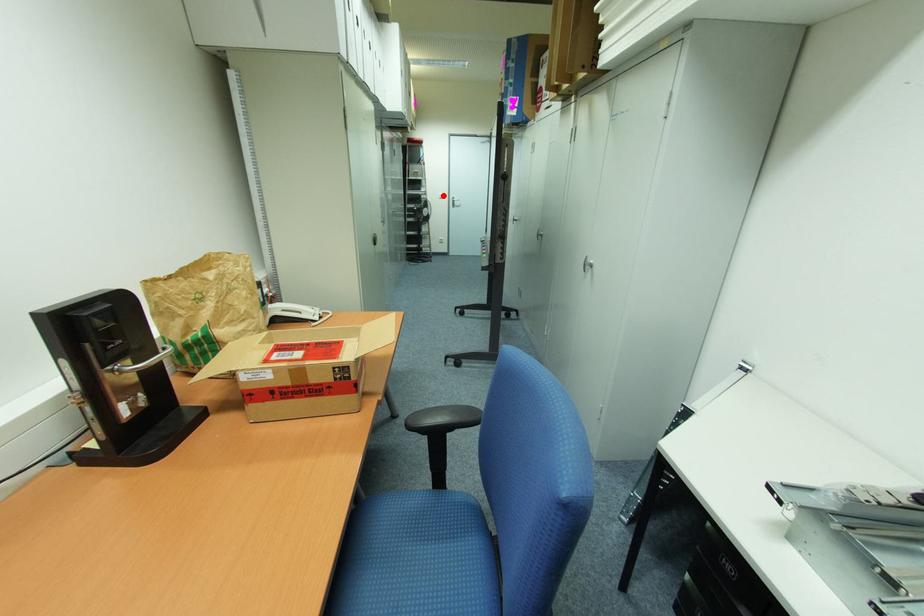
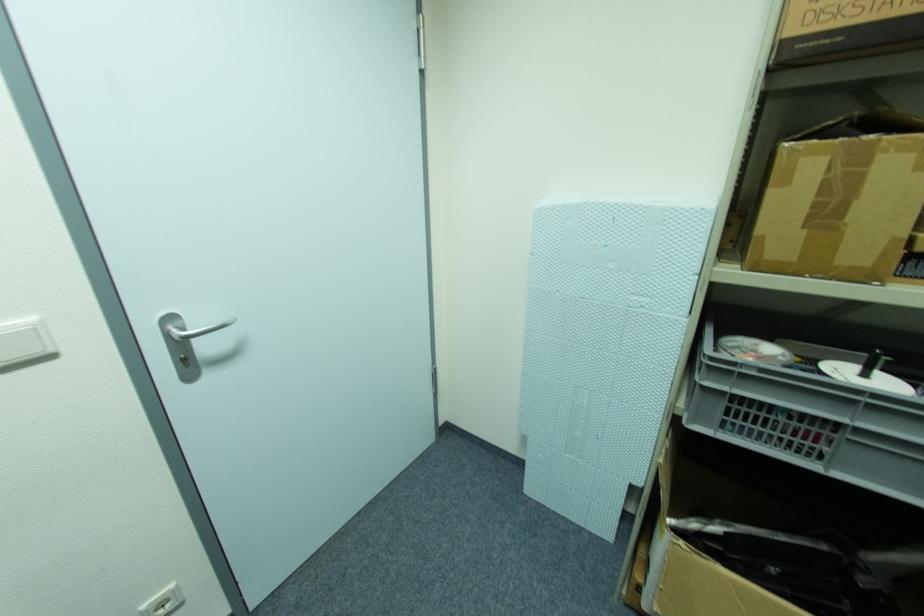
Question: I am providing you with two images of the same scene from different viewpoints. A red point is marked on the first image. Is the red point's position out of view in image 2?

Choices:
 (A) Yes
 (B) No

Answer: (B)